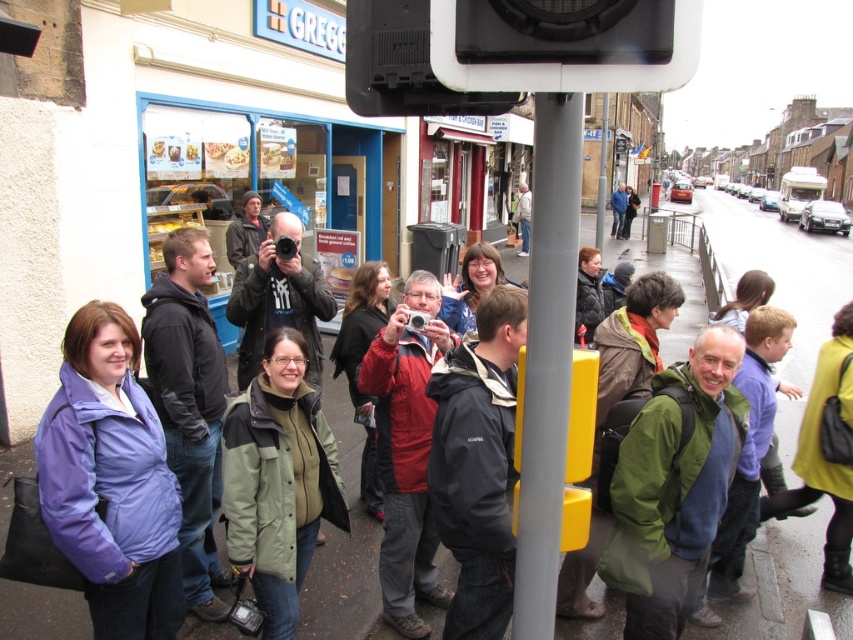
Is dark gray jacket at center to the left of red matte jacket at center from the viewer's perspective?

No, dark gray jacket at center is not to the left of red matte jacket at center.

Can you confirm if dark gray jacket at center is taller than red matte jacket at center?

Incorrect, dark gray jacket at center's height is not larger of red matte jacket at center's.

Where is `dark gray jacket at center`? This screenshot has height=640, width=853. dark gray jacket at center is located at coordinates (479, 464).

Find the location of `dark gray jacket at center`. dark gray jacket at center is located at coordinates (479, 464).

Can you confirm if green matte jacket at center is positioned to the right of dark gray jacket at center?

No, green matte jacket at center is not to the right of dark gray jacket at center.

Between point (244, 561) and point (440, 538), which one is positioned behind?

Point (244, 561)

Locate an element on the screen. green matte jacket at center is located at coordinates (277, 481).

Between green matte jacket at center and matte black jacket at center, which one appears on the right side from the viewer's perspective?

green matte jacket at center

Can you confirm if green matte jacket at center is bigger than matte black jacket at center?

No, green matte jacket at center is not bigger than matte black jacket at center.

The image size is (853, 640). Identify the location of green matte jacket at center. tap(277, 481).

You are a GUI agent. You are given a task and a screenshot of the screen. Output one action in this format:
    pyautogui.click(x=<x>, y=<y>)
    Task: Click on the green matte jacket at center
    Image resolution: width=853 pixels, height=640 pixels.
    Given the screenshot: What is the action you would take?
    pyautogui.click(x=277, y=481)